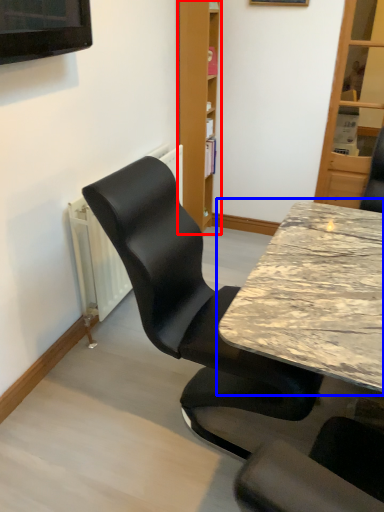
Question: Which object appears farthest to the camera in this image, bookshelf (highlighted by a red box) or table (highlighted by a blue box)?

Choices:
 (A) bookshelf
 (B) table

Answer: (A)